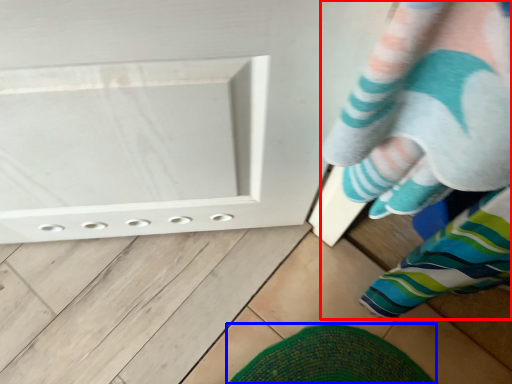
Question: Which point is further to the camera, person (highlighted by a red box) or footwear (highlighted by a blue box)?

Choices:
 (A) person
 (B) footwear

Answer: (B)